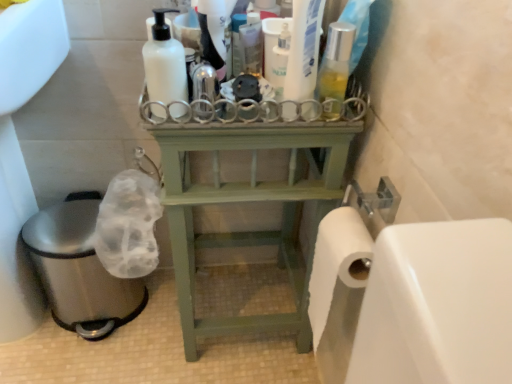
Question: From the image's perspective, relative to translucent plastic bottle at center, placed as the 4th cleaning product when sorted from left to right, is green wood shelf at center above or below?

Choices:
 (A) above
 (B) below

Answer: (B)

Question: Is green wood shelf at center in front of or behind translucent plastic bottle at center, placed as the 4th cleaning product when sorted from left to right, in the image?

Choices:
 (A) front
 (B) behind

Answer: (B)

Question: Estimate the real-world distances between objects in this image. Which object is closer to the translucent plastic bottle at upper center, which appears as the second cleaning product when viewed from the right?

Choices:
 (A) white matte bottle at upper center, which appears as the fourth cleaning product when viewed from the right
 (B) brushed metal sink at lower left
 (C) translucent plastic bottle at center, the first cleaning product from the right
 (D) translucent plastic spray bottle at center, which is the 3th cleaning product from right to left
 (E) green wood shelf at center

Answer: (C)

Question: Which object is positioned closest to the green wood shelf at center?

Choices:
 (A) translucent plastic bottle at center, the first cleaning product from the right
 (B) white matte bottle at upper center, which appears as the fourth cleaning product when viewed from the right
 (C) brushed metal sink at lower left
 (D) translucent plastic spray bottle at center, which is the 3th cleaning product from right to left
 (E) translucent plastic bottle at upper center, which appears as the second cleaning product when viewed from the right

Answer: (A)